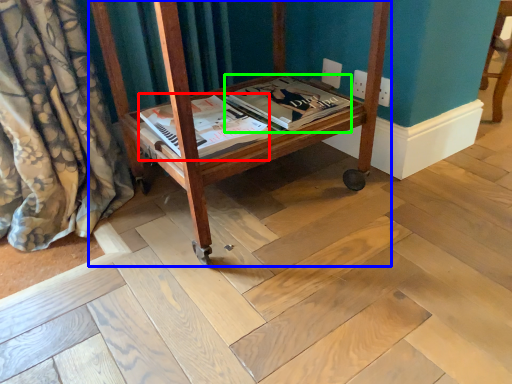
Question: Which object is positioned closest to magazine (highlighted by a red box)? Select from furniture (highlighted by a blue box) and magazine (highlighted by a green box).

Choices:
 (A) furniture
 (B) magazine

Answer: (B)